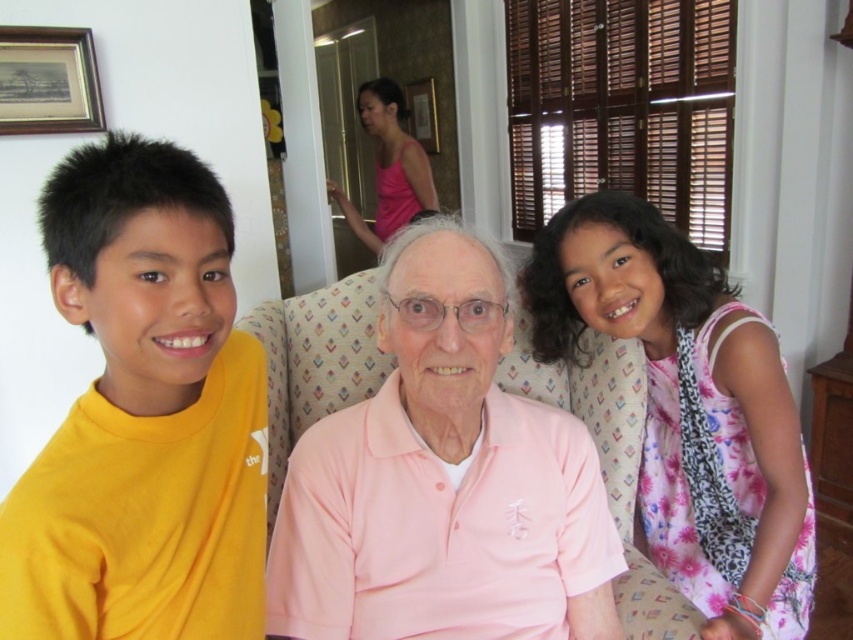
Does pink cotton polo shirt at center have a greater width compared to pink fabric at upper center?

Correct, the width of pink cotton polo shirt at center exceeds that of pink fabric at upper center.

Is point (608, 636) farther from camera compared to point (380, 100)?

No, it is in front of (380, 100).

Which is behind, point (426, 339) or point (393, 161)?

The point (393, 161) is more distant.

This screenshot has height=640, width=853. Find the location of `pink cotton polo shirt at center`. pink cotton polo shirt at center is located at coordinates pyautogui.click(x=444, y=481).

Between pink cotton polo shirt at center and wooden framed print at upper left, which one appears on the right side from the viewer's perspective?

pink cotton polo shirt at center

Does pink cotton polo shirt at center have a greater height compared to wooden framed print at upper left?

Yes, pink cotton polo shirt at center is taller than wooden framed print at upper left.

Does point (372, 454) come in front of point (90, 49)?

Yes, point (372, 454) is in front of point (90, 49).

Identify the location of pink cotton polo shirt at center. 444,481.

Can you confirm if yellow matte shirt at left is positioned below wooden framed print at upper left?

Yes, yellow matte shirt at left is below wooden framed print at upper left.

Is yellow matte shirt at left to the left of wooden framed print at upper left from the viewer's perspective?

No, yellow matte shirt at left is not to the left of wooden framed print at upper left.

You are a GUI agent. You are given a task and a screenshot of the screen. Output one action in this format:
    pyautogui.click(x=<x>, y=<y>)
    Task: Click on the yellow matte shirt at left
    The height and width of the screenshot is (640, 853).
    Given the screenshot: What is the action you would take?
    pyautogui.click(x=143, y=417)

Where is `yellow matte shirt at left`? yellow matte shirt at left is located at coordinates (143, 417).